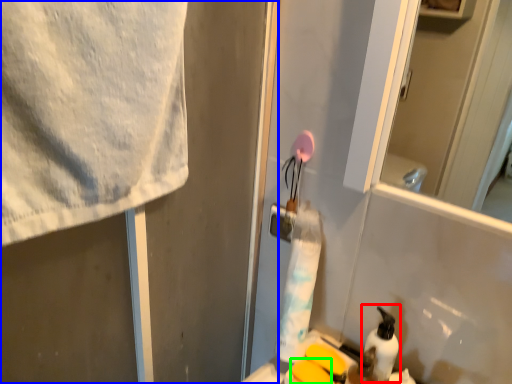
Question: Which is nearer to the cleaning product (highlighted by a red box)? screen door (highlighted by a blue box) or soap (highlighted by a green box).

Choices:
 (A) screen door
 (B) soap

Answer: (B)